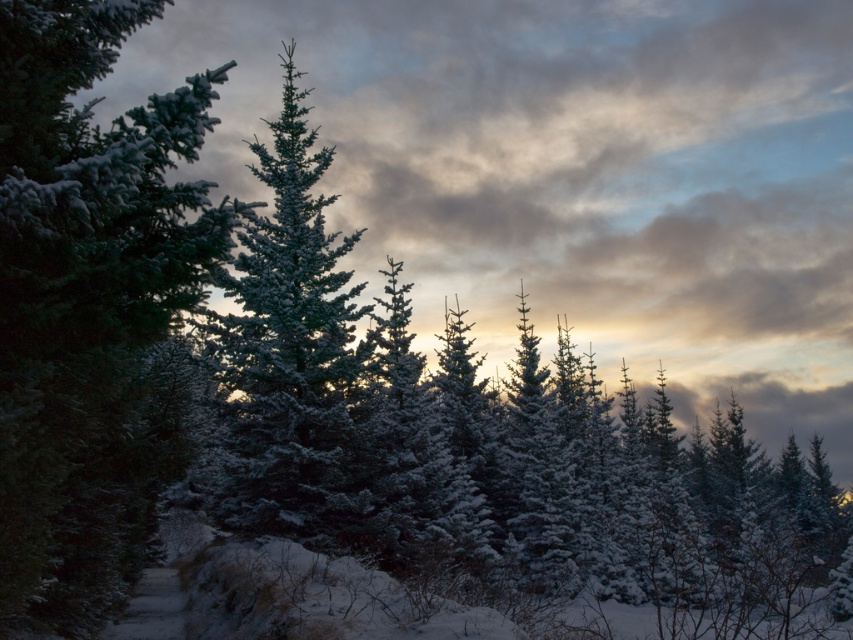
In the scene shown: You are standing in the winter landscape and want to walk towards the point that is closer to you. Which point should you head towards, point (67,566) or point (316,221)?

Point (67,566) is in front of point (316,221), so you should head towards point (67,566) as it is closer to you.